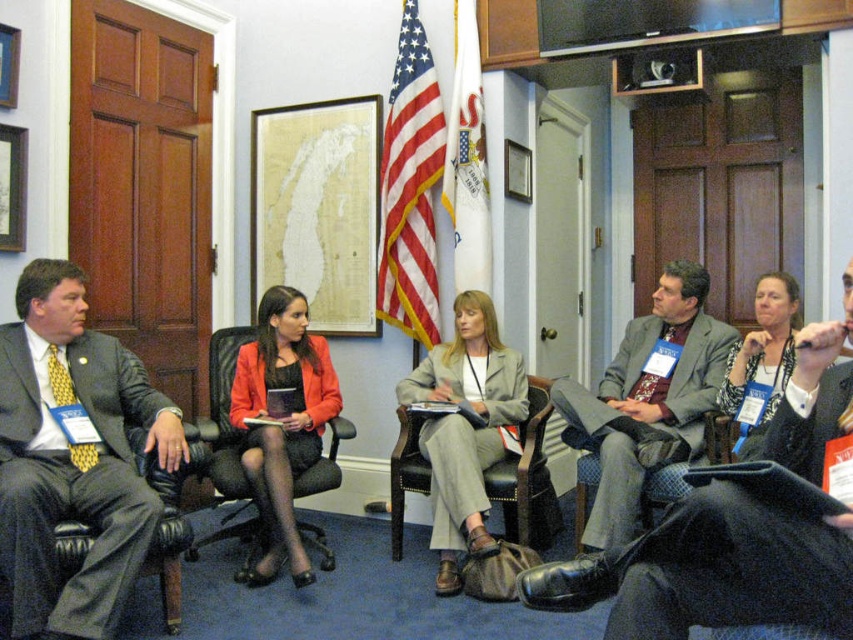
Consider the image. You are a photographer in the conference room who wants to capture a clear photo of the matte gray blazer at center without the metallic silver trophy at upper center appearing in the background. Is this possible given their positions?

The matte gray blazer at center is in front of the metallic silver trophy at upper center, so taking a photo focused on the matte gray blazer at center with a shallow depth of field could blur the metallic silver trophy at upper center in the background, making it less visible.

You are a photographer trying to capture a group photo of the matte black suit at left and the plush fabric chair at center. You want to ensure both subjects are fully visible in the frame. Based on their sizes, which subject might require more space in the photo composition?

The matte black suit at left might be wider than the plush fabric chair at center, so it might require more space in the photo composition.